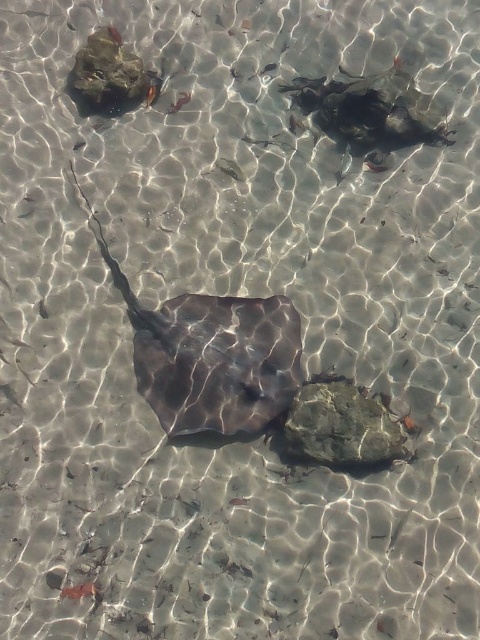
Question: Is smooth dark gray stingray at center positioned at the back of green mossy rock at center?

Choices:
 (A) yes
 (B) no

Answer: (A)

Question: Does smooth dark gray stingray at center lie in front of green mossy rock at center?

Choices:
 (A) yes
 (B) no

Answer: (B)

Question: Is smooth dark gray stingray at center behind green mossy rock at center?

Choices:
 (A) yes
 (B) no

Answer: (A)

Question: Which of the following is the closest to the observer?

Choices:
 (A) (218, 404)
 (B) (343, 449)

Answer: (B)

Question: Which point appears closest to the camera in this image?

Choices:
 (A) (333, 465)
 (B) (245, 307)

Answer: (A)